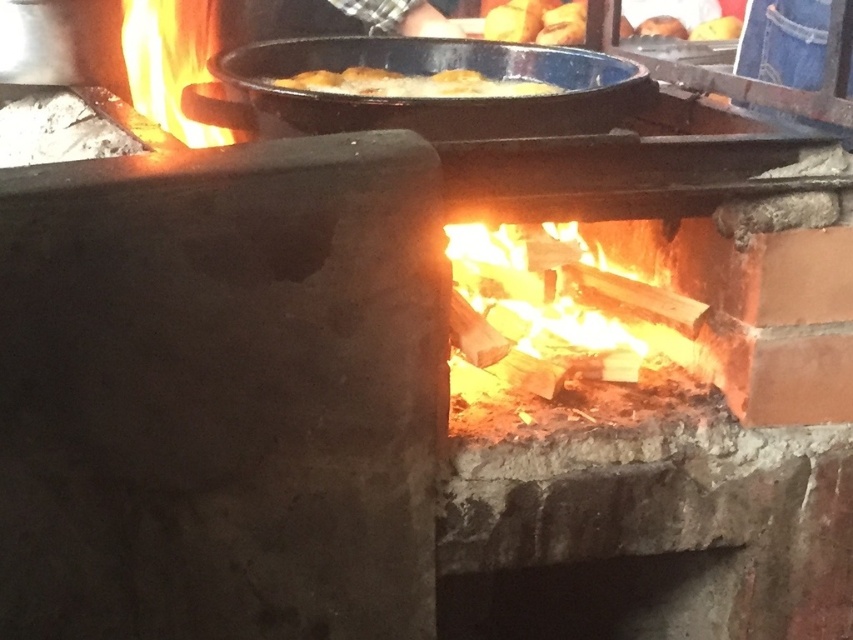
You are a chef standing in front of the rustic outdoor cooking setup. You need to place a new ingredient into the blue enameled cast iron wok at upper center. Based on the coordinates provided, where exactly should you aim to place the ingredient?

The blue enameled cast iron wok at upper center is located at coordinates point [440,99]. So you should aim to place the ingredient at point [440,99].

You are standing in front of the rustic outdoor cooking setup. You need to grab a wooden spoon from the golden crispy bread at upper center to stir the charcoal wood fire at center. Which object should you reach for first, and why?

You should reach for the golden crispy bread at upper center first because the charcoal wood fire at center is closer to the viewer, so the bread is farther away and requires reaching further to get the spoon before accessing the fire safely.

You are a chef preparing a dish and need to transfer the golden crispy bread at upper center to the blue enameled cast iron wok at upper center. Given that your spatula is 3 inches long, can you reach from the bread to the wok without moving either?

The blue enameled cast iron wok at upper center and golden crispy bread at upper center are 3.87 inches apart. Since your spatula is only 3 inches long, it is not long enough to cover the 3.87 inch gap between them. You would need a longer utensil to make the transfer without moving either item.